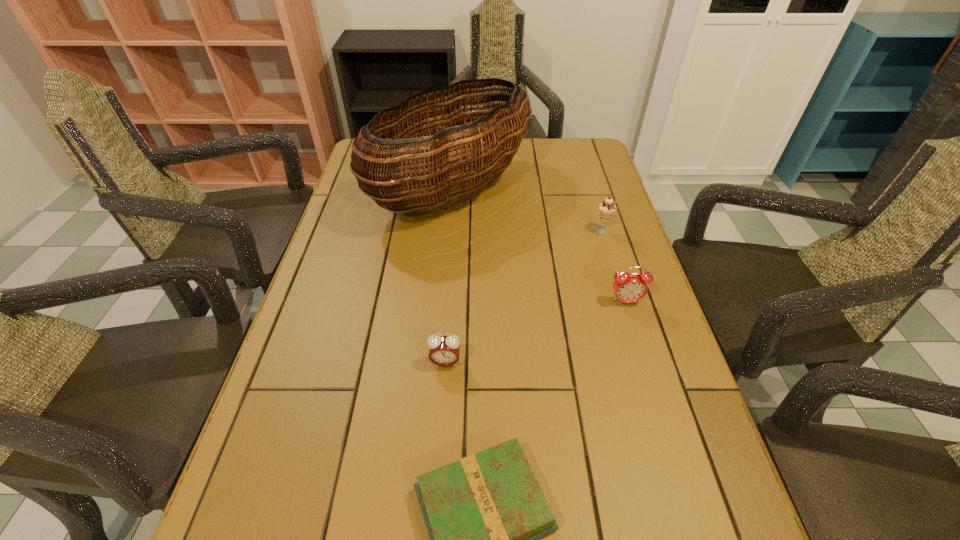
The height and width of the screenshot is (540, 960). I want to click on the tallest object, so click(x=469, y=149).

Identify the location of icecream. The image size is (960, 540). (607, 208).

Locate an element on the screen. The height and width of the screenshot is (540, 960). the right alarm clock is located at coordinates click(628, 288).

At what (x,y) coordinates should I click in order to perform the action: click on the taller alarm clock. Please return your answer as a coordinate pair (x, y). This screenshot has height=540, width=960. Looking at the image, I should click on (628, 288).

Identify the location of the nearer alarm clock. The image size is (960, 540). (443, 350).

This screenshot has width=960, height=540. In order to click on the left alarm clock in this screenshot , I will do `click(443, 350)`.

Where is `free point located 0.060m on the left of the basket`? The image size is (960, 540). free point located 0.060m on the left of the basket is located at coordinates (352, 192).

In order to click on vacant area situated on the back of the icecream in this screenshot , I will do `click(583, 167)`.

Where is `vacant space located 0.120m on the face of the right alarm clock`? The width and height of the screenshot is (960, 540). vacant space located 0.120m on the face of the right alarm clock is located at coordinates (640, 350).

Find the location of a particular element. The image size is (960, 540). vacant space located on the clock face of the fourth farthest object is located at coordinates (440, 452).